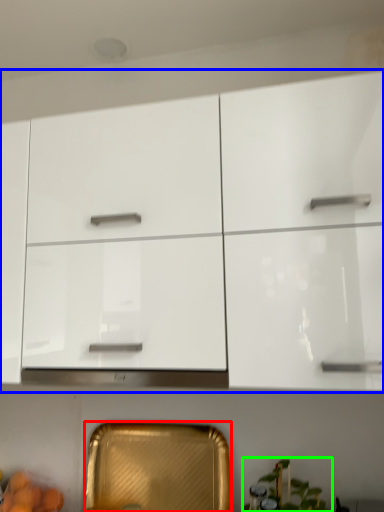
Question: Based on their relative distances, which object is nearer to cabinetry (highlighted by a red box)? Choose from cabinetry (highlighted by a blue box) and plant (highlighted by a green box).

Choices:
 (A) cabinetry
 (B) plant

Answer: (B)